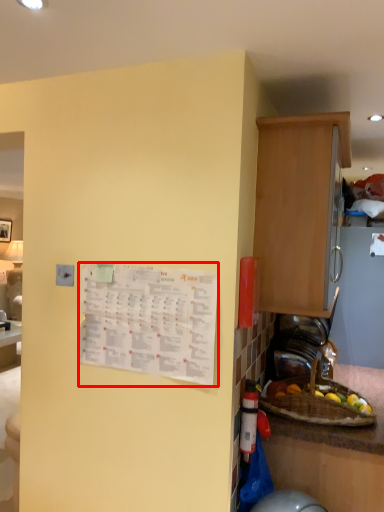
Question: From the image's perspective, where is poster (annotated by the red box) located relative to cabinetry?

Choices:
 (A) above
 (B) below

Answer: (B)